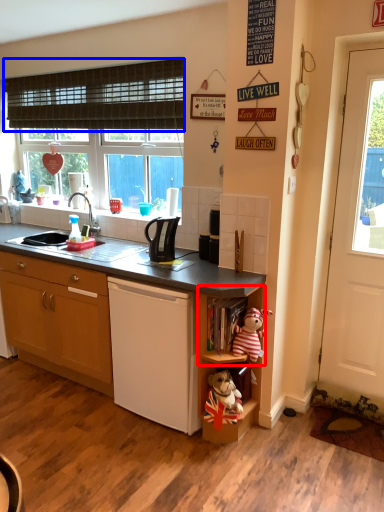
Question: Which of the following is the closest to the observer, shelf (highlighted by a red box) or curtain (highlighted by a blue box)?

Choices:
 (A) shelf
 (B) curtain

Answer: (A)